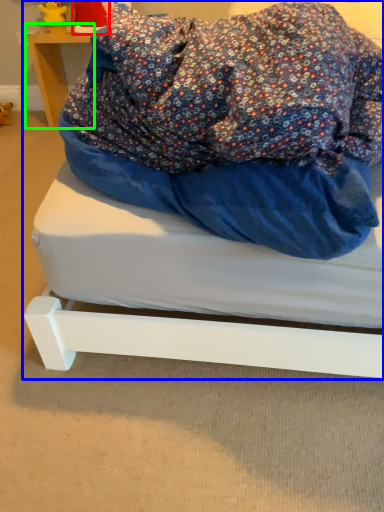
Question: Based on their relative distances, which object is nearer to toy (highlighted by a red box)? Choose from bed (highlighted by a blue box) and furniture (highlighted by a green box).

Choices:
 (A) bed
 (B) furniture

Answer: (B)